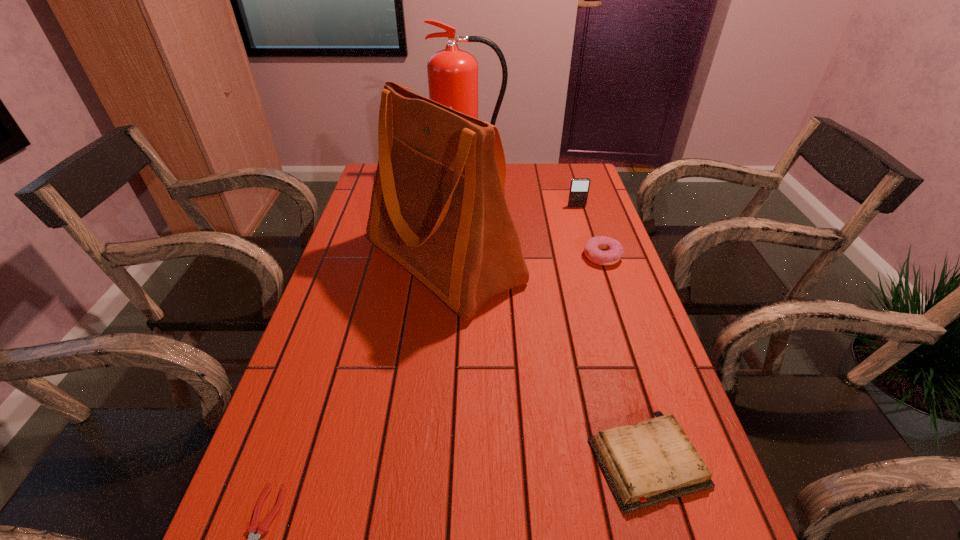
The width and height of the screenshot is (960, 540). What are the coordinates of `fire extinguisher` in the screenshot? It's located at (452, 72).

Where is `shopping bag`? The height and width of the screenshot is (540, 960). shopping bag is located at coordinates (438, 208).

At what (x,y) coordinates should I click in order to perform the action: click on iPod. Please return your answer as a coordinate pair (x, y). The image size is (960, 540). Looking at the image, I should click on (579, 187).

Where is `the second farthest object`? Image resolution: width=960 pixels, height=540 pixels. the second farthest object is located at coordinates (579, 187).

The image size is (960, 540). I want to click on the fourth tallest object, so click(x=613, y=250).

Locate an element on the screen. the fifth tallest object is located at coordinates (654, 461).

Locate an element on the screen. vacant area situated 0.220m towards the nozzle of the farthest object is located at coordinates (468, 221).

Locate an element on the screen. The image size is (960, 540). blank area located on the right of the shopping bag is located at coordinates (604, 261).

Locate an element on the screen. The width and height of the screenshot is (960, 540). free space located 0.110m on the front-facing side of the iPod is located at coordinates (583, 226).

This screenshot has width=960, height=540. In order to click on vacant space located 0.330m on the left of the third shortest object in this screenshot , I will do `click(466, 256)`.